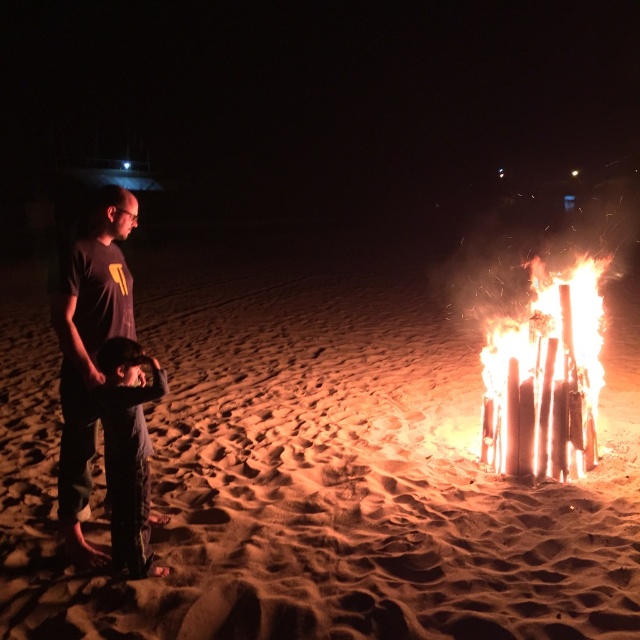
Question: Among these objects, which one is farthest from the camera?

Choices:
 (A) dark gray t-shirt at left
 (B) dark gray pants at lower left
 (C) smooth sand at center

Answer: (A)

Question: Can you confirm if smooth sand at center is wider than dark gray t-shirt at left?

Choices:
 (A) no
 (B) yes

Answer: (B)

Question: From the image, what is the correct spatial relationship of dark gray t-shirt at left in relation to dark gray pants at lower left?

Choices:
 (A) below
 (B) above

Answer: (B)

Question: Which point is closer to the camera taking this photo?

Choices:
 (A) (116, 524)
 (B) (531, 268)
 (C) (125, 221)

Answer: (A)

Question: Which object is closer to the camera taking this photo?

Choices:
 (A) dark gray t-shirt at left
 (B) dark gray pants at lower left
 (C) bright orange wood at right
 (D) smooth sand at center

Answer: (D)

Question: Does bright orange wood at right have a greater width compared to dark gray t-shirt at left?

Choices:
 (A) yes
 (B) no

Answer: (B)